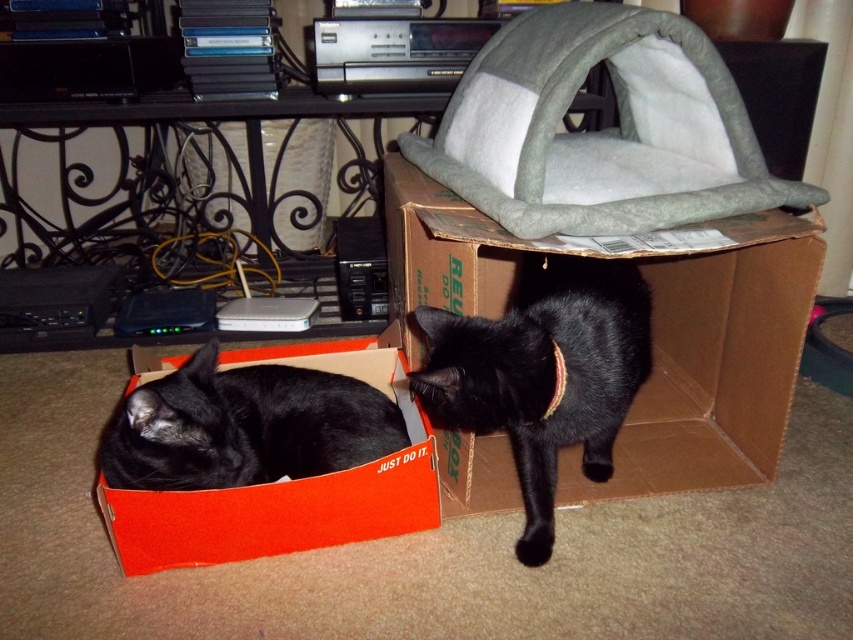
You are a veterinarian examining two cats in an image. The cats are the black fur cat at center and the black smooth cat at lower left. Which cat would you estimate to have a larger body size based on their appearance in the image?

The black fur cat at center is bigger than the black smooth cat at lower left, so the veterinarian would estimate the black fur cat at center to have a larger body size.

You are a photographer setting up a shot of the two cats. You want to ensure both the cardboard box at center and the black smooth cat at lower left are in focus. Since you can only focus on one object at a time, which one should you focus on to make sure the other is also in focus?

You should focus on the black smooth cat at lower left because it is closer to you than the cardboard box at center. By focusing on the closer object, the further one will also be in focus due to the depth of field.

You are a cat owner who wants to ensure your pets can access their favorite spots. Given the scene described, can the black fur cat at center comfortably stand up inside the cardboard box at center without touching the top?

The cardboard box at center is taller than the black fur cat at center, so the cat can comfortably stand up inside the cardboard box at center without touching the top.